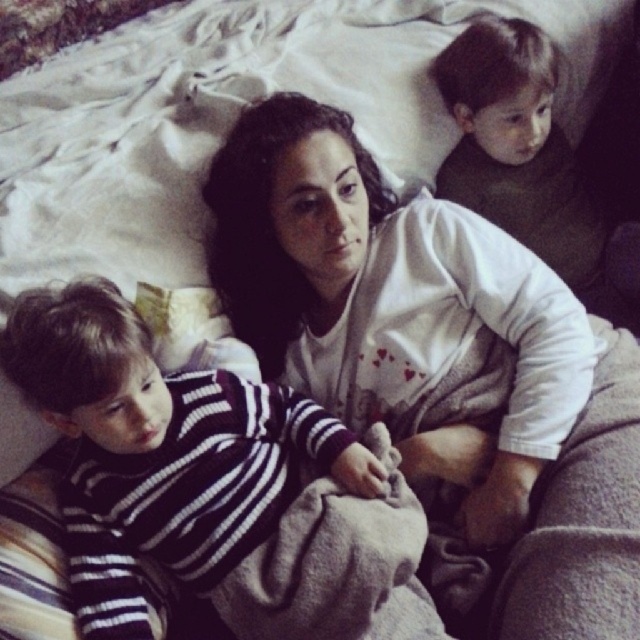
Question: Is white soft sweater at center to the right of dark green sweater at upper right from the viewer's perspective?

Choices:
 (A) yes
 (B) no

Answer: (B)

Question: Observing the image, what is the correct spatial positioning of white soft sweater at center in reference to dark green sweater at upper right?

Choices:
 (A) right
 (B) left

Answer: (B)

Question: Which point appears closest to the camera in this image?

Choices:
 (A) (260, 125)
 (B) (81, 484)

Answer: (B)

Question: Is striped knit sweater at left positioned behind dark green sweater at upper right?

Choices:
 (A) yes
 (B) no

Answer: (B)

Question: Considering the real-world distances, which object is closest to the striped knit sweater at left?

Choices:
 (A) white soft sweater at center
 (B) dark green sweater at upper right

Answer: (A)

Question: Which point is farther to the camera?

Choices:
 (A) striped knit sweater at left
 (B) dark green sweater at upper right
 (C) white soft sweater at center

Answer: (B)